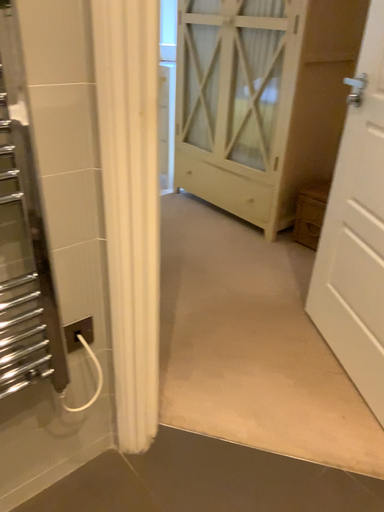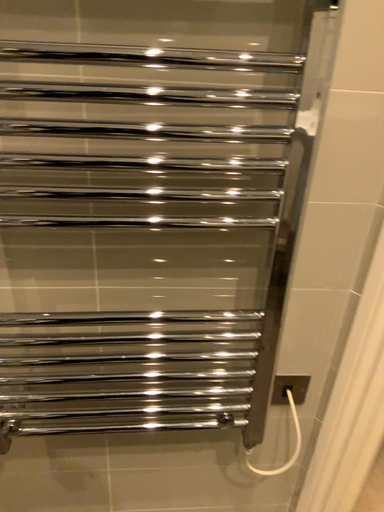
Question: Which way did the camera rotate in the video?

Choices:
 (A) rotated left
 (B) rotated right

Answer: (A)